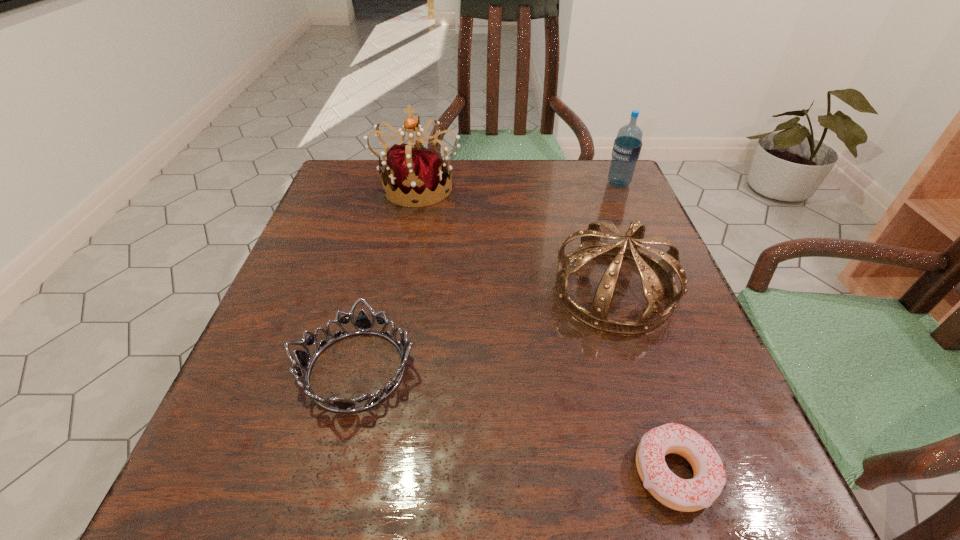
Locate an element on the screen. This screenshot has height=540, width=960. vacant position located 0.100m on the front-facing side of the second shortest object is located at coordinates 325,498.

This screenshot has height=540, width=960. I want to click on free spot located 0.180m on the left of the shortest object, so click(499, 472).

Where is `tiara that is at the far edge`? This screenshot has height=540, width=960. tiara that is at the far edge is located at coordinates (417, 174).

Find the location of `water bottle at the far edge`. water bottle at the far edge is located at coordinates (627, 146).

Identify the location of object present at the near edge. The image size is (960, 540). (687, 495).

The image size is (960, 540). What are the coordinates of `water bottle present at the right edge` in the screenshot? It's located at (627, 146).

At what (x,y) coordinates should I click in order to perform the action: click on tiara positioned at the right edge. Please return your answer as a coordinate pair (x, y). Looking at the image, I should click on (x=651, y=270).

Locate an element on the screen. This screenshot has width=960, height=540. doughnut that is at the right edge is located at coordinates (687, 495).

Find the location of `object that is at the far left corner`. object that is at the far left corner is located at coordinates click(417, 174).

Identify the location of object at the far right corner. (627, 146).